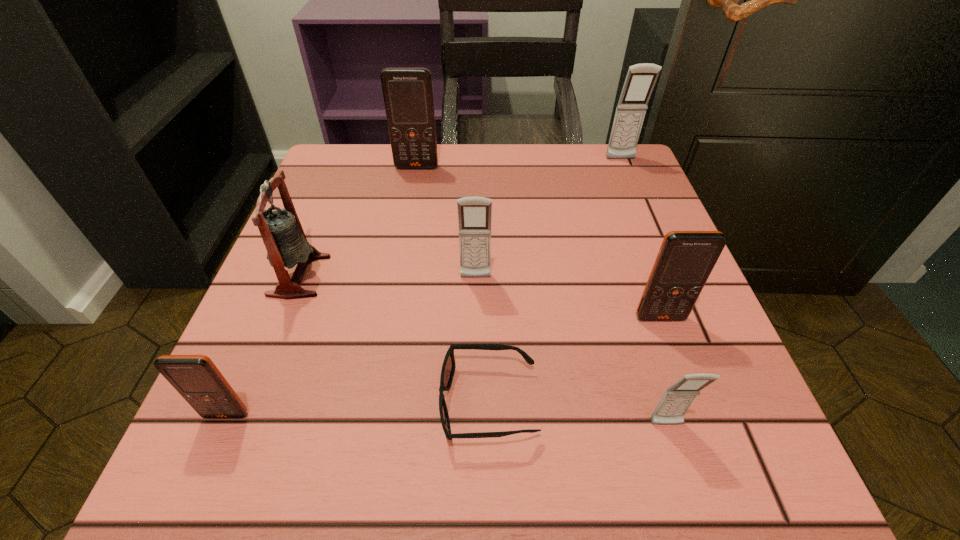
Image resolution: width=960 pixels, height=540 pixels. What are the coordinates of `vacant region between the bell and the sunglasses` in the screenshot? It's located at (394, 339).

The image size is (960, 540). In order to click on empty space that is in between the leftmost gray cellular telephone and the seventh nearest object in this screenshot , I will do pyautogui.click(x=446, y=222).

The image size is (960, 540). Identify the location of vacant space in between the bell and the sunglasses. (394, 339).

Identify the location of free space that is in between the farthest cellular telephone and the biggest orange cellular telephone. The width and height of the screenshot is (960, 540). (518, 164).

Where is `free spot between the rightmost orange cellular telephone and the bell`? free spot between the rightmost orange cellular telephone and the bell is located at coordinates (480, 296).

Where is `free spot between the nearest orange cellular telephone and the sunglasses`? free spot between the nearest orange cellular telephone and the sunglasses is located at coordinates (357, 409).

What are the coordinates of `object that is the closest to the sunglasses` in the screenshot? It's located at (677, 399).

Identify which object is located as the fifth nearest to the shortest object. Please provide its 2D coordinates. Your answer should be formatted as a tuple, i.e. [(x, y)], where the tuple contains the x and y coordinates of a point satisfying the conditions above.

[(196, 378)]

Locate an element on the screen. This screenshot has width=960, height=540. the second closest cellular telephone to the fifth nearest cellular telephone is located at coordinates (641, 78).

Locate an element on the screen. This screenshot has height=540, width=960. cellular telephone that is the sixth nearest to the shortest object is located at coordinates (641, 78).